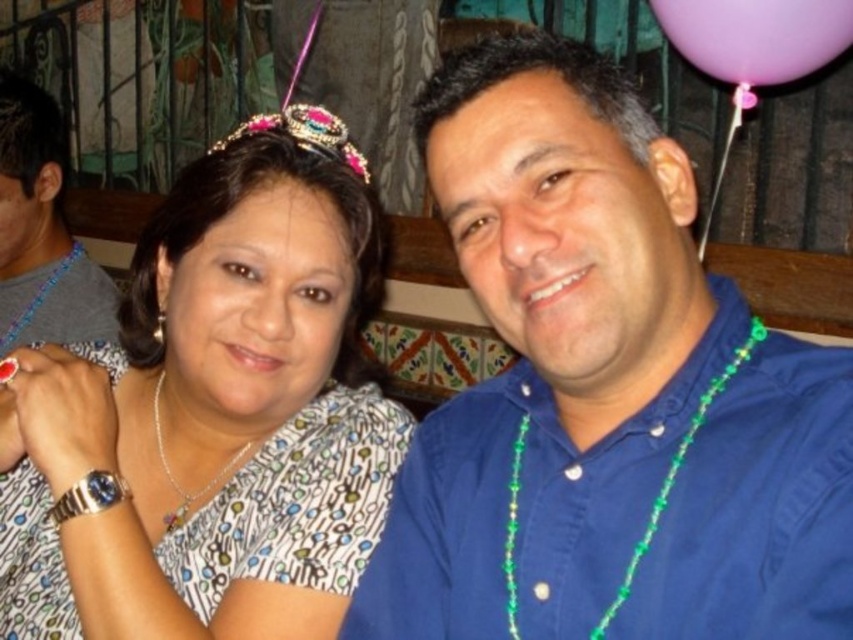
You are at a party and want to hang a photo frame between the purple latex balloon at upper right and the sparkly pink and blue tiara at upper center. Based on their positions, where should you place the photo frame?

The purple latex balloon at upper right is located above the sparkly pink and blue tiara at upper center, so the photo frame should be placed between them, below the balloon and above the tiara.

Looking at this image, you are planning to hang a decoration that requires knowing the width of the purple latex balloon at upper right and the sparkly pink and blue tiara at upper center. Based on the scene, can you determine which one is wider?

The purple latex balloon at upper right might be wider than sparkly pink and blue tiara at upper center according to the description.

You are a photographer at a celebration and want to capture a closeup of the blue matte shirt at upper right and the green beaded necklace at right. Which object should you focus on first to ensure both are in focus?

The blue matte shirt at upper right is closer to the viewer than the green beaded necklace at right, so focus on the blue matte shirt at upper right first to ensure both are in focus.